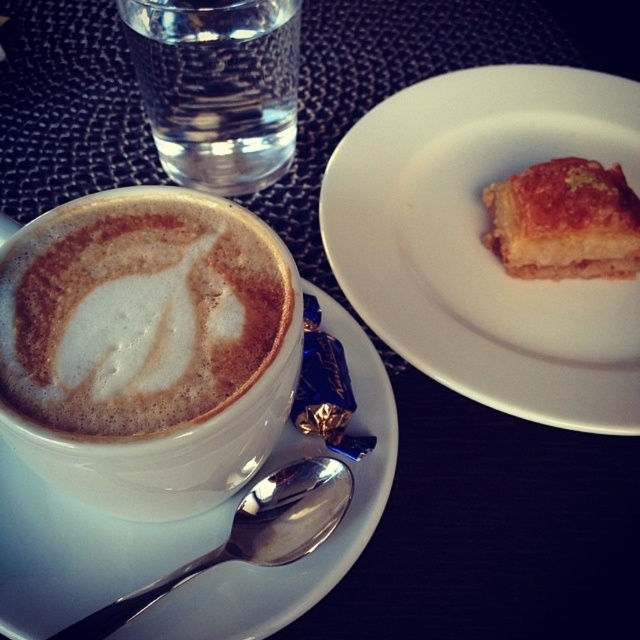
Can you confirm if golden-brown flaky pastry at upper right is positioned to the right of golden brown flaky pastry at upper right?

Incorrect, golden-brown flaky pastry at upper right is not on the right side of golden brown flaky pastry at upper right.

Can you confirm if golden-brown flaky pastry at upper right is smaller than golden brown flaky pastry at upper right?

→ Actually, golden-brown flaky pastry at upper right might be larger than golden brown flaky pastry at upper right.

Between point (384, 220) and point (490, 243), which one is positioned in front?

Positioned in front is point (384, 220).

Find the location of a particular element. This screenshot has width=640, height=640. golden-brown flaky pastry at upper right is located at coordinates (483, 244).

Is clear glass water at upper left behind golden brown flaky pastry at upper right?

Yes, clear glass water at upper left is further from the viewer.

Which is in front, point (260, 77) or point (582, 189)?

Point (582, 189) is in front.

Which is in front, point (250, 45) or point (509, 234)?

Point (509, 234) is more forward.

At what (x,y) coordinates should I click in order to perform the action: click on clear glass water at upper left. Please return your answer as a coordinate pair (x, y). The height and width of the screenshot is (640, 640). Looking at the image, I should click on (218, 88).

Does point (273, 326) lie behind point (612, 221)?

No, (273, 326) is in front of (612, 221).

Is white frothy latte art at center further to camera compared to golden brown flaky pastry at upper right?

No, white frothy latte art at center is in front of golden brown flaky pastry at upper right.

Which is behind, point (74, 285) or point (579, 179)?

Point (579, 179)

Locate an element on the screen. Image resolution: width=640 pixels, height=640 pixels. white frothy latte art at center is located at coordinates (138, 316).